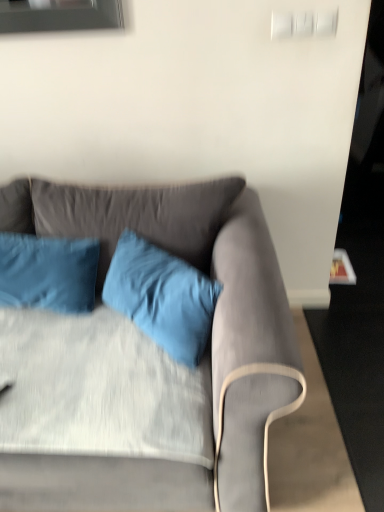
Question: Considering the relative sizes of velvet blue pillow at center, the first pillow when ordered from right to left, and blue satin pillow at left, the 2th pillow positioned from the right, in the image provided, is velvet blue pillow at center, the first pillow when ordered from right to left, taller than blue satin pillow at left, the 2th pillow positioned from the right,?

Choices:
 (A) yes
 (B) no

Answer: (A)

Question: Can you confirm if velvet blue pillow at center, the first pillow when ordered from right to left, is positioned to the left of blue satin pillow at left, which ranks as the 1th pillow in left-to-right order?

Choices:
 (A) yes
 (B) no

Answer: (B)

Question: Is velvet blue pillow at center, the first pillow when ordered from right to left, in contact with blue satin pillow at left, the 2th pillow positioned from the right?

Choices:
 (A) no
 (B) yes

Answer: (A)

Question: Does velvet blue pillow at center, which appears as the second pillow when viewed from the left, have a greater width compared to blue satin pillow at left, which ranks as the 1th pillow in left-to-right order?

Choices:
 (A) no
 (B) yes

Answer: (B)

Question: Is velvet blue pillow at center, the first pillow when ordered from right to left, bigger than blue satin pillow at left, which ranks as the 1th pillow in left-to-right order?

Choices:
 (A) no
 (B) yes

Answer: (B)

Question: From the image's perspective, does velvet blue pillow at center, the first pillow when ordered from right to left, appear lower than blue satin pillow at left, which ranks as the 1th pillow in left-to-right order?

Choices:
 (A) no
 (B) yes

Answer: (B)

Question: Is blue satin pillow at left, which ranks as the 1th pillow in left-to-right order, bigger than velvet blue pillow at center, which appears as the second pillow when viewed from the left?

Choices:
 (A) no
 (B) yes

Answer: (A)

Question: Is the position of blue satin pillow at left, the 2th pillow positioned from the right, more distant than that of velvet blue pillow at center, the first pillow when ordered from right to left?

Choices:
 (A) no
 (B) yes

Answer: (B)

Question: Can you confirm if blue satin pillow at left, which ranks as the 1th pillow in left-to-right order, is thinner than velvet blue pillow at center, the first pillow when ordered from right to left?

Choices:
 (A) no
 (B) yes

Answer: (B)

Question: From a real-world perspective, is blue satin pillow at left, the 2th pillow positioned from the right, on velvet blue pillow at center, the first pillow when ordered from right to left?

Choices:
 (A) no
 (B) yes

Answer: (B)

Question: Is blue satin pillow at left, the 2th pillow positioned from the right, oriented away from velvet blue pillow at center, which appears as the second pillow when viewed from the left?

Choices:
 (A) yes
 (B) no

Answer: (B)

Question: Can you confirm if blue satin pillow at left, the 2th pillow positioned from the right, is shorter than velvet blue pillow at center, which appears as the second pillow when viewed from the left?

Choices:
 (A) yes
 (B) no

Answer: (A)

Question: Can you confirm if velvet blue pillow at center, the first pillow when ordered from right to left, is smaller than matte gray couch at center?

Choices:
 (A) yes
 (B) no

Answer: (A)